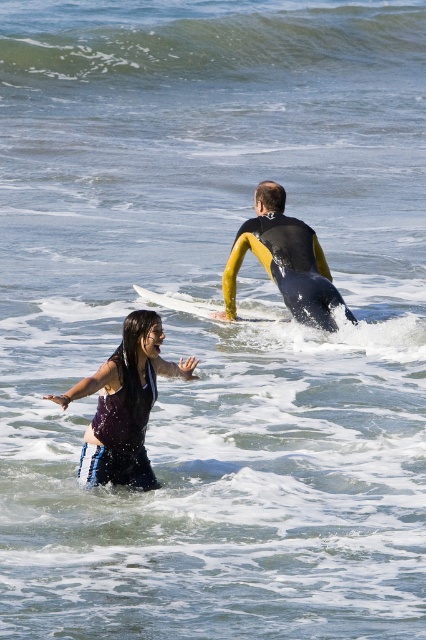
Can you confirm if shiny purple wetsuit at lower left is thinner than white foam surfboard at center?

Yes.

What do you see at coordinates (121, 429) in the screenshot? Image resolution: width=426 pixels, height=640 pixels. I see `shiny purple wetsuit at lower left` at bounding box center [121, 429].

I want to click on shiny purple wetsuit at lower left, so click(121, 429).

You are a GUI agent. You are given a task and a screenshot of the screen. Output one action in this format:
    pyautogui.click(x=<x>, y=<y>)
    Task: Click on the dark purple wetsuit at center
    
    Given the screenshot: What is the action you would take?
    point(126,403)

Does dark purple wetsuit at center lie behind dark purple wetsuit at lower left?

Yes.

Is point (238, 256) positioned behind point (154, 397)?

That is True.

Find the location of a particular element. dark purple wetsuit at center is located at coordinates (126, 403).

Which is below, dark purple wetsuit at lower left or yellow neoprene wetsuit at center?

dark purple wetsuit at lower left is lower down.

Is dark purple wetsuit at lower left thinner than yellow neoprene wetsuit at center?

Yes, dark purple wetsuit at lower left is thinner than yellow neoprene wetsuit at center.

Between point (124, 376) and point (321, 298), which one is positioned behind?

Positioned behind is point (321, 298).

This screenshot has height=640, width=426. I want to click on dark purple wetsuit at lower left, so click(124, 404).